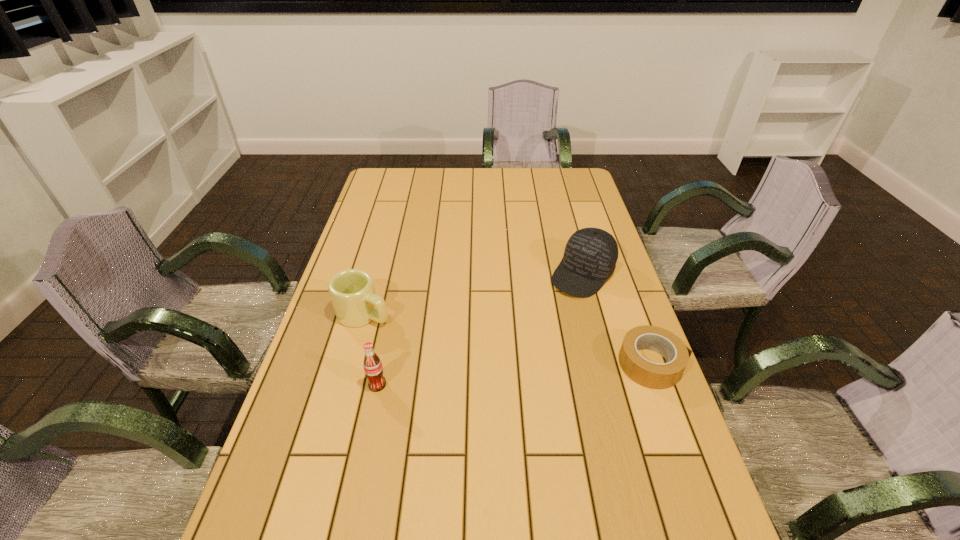
Identify the location of soda. (373, 368).

The image size is (960, 540). I want to click on the shortest object, so click(x=652, y=375).

Locate an element on the screen. The height and width of the screenshot is (540, 960). the third tallest object is located at coordinates (352, 292).

Image resolution: width=960 pixels, height=540 pixels. I want to click on mug, so click(x=352, y=292).

Find the location of a particular element. The height and width of the screenshot is (540, 960). the farthest object is located at coordinates (590, 257).

Where is `vacant space located 0.350m on the right of the soda`? The image size is (960, 540). vacant space located 0.350m on the right of the soda is located at coordinates (529, 384).

Image resolution: width=960 pixels, height=540 pixels. I want to click on vacant space located 0.070m with the handle on the side of the second farthest object, so click(x=406, y=331).

The width and height of the screenshot is (960, 540). Find the location of `vacant region located 0.220m with the handle on the side of the second farthest object`. vacant region located 0.220m with the handle on the side of the second farthest object is located at coordinates (452, 352).

Where is `vacant space located 0.110m with the handle on the side of the second farthest object`? This screenshot has height=540, width=960. vacant space located 0.110m with the handle on the side of the second farthest object is located at coordinates (418, 336).

This screenshot has height=540, width=960. I want to click on vacant space situated 0.360m at the front of the baseball cap where the brim is located, so click(x=497, y=370).